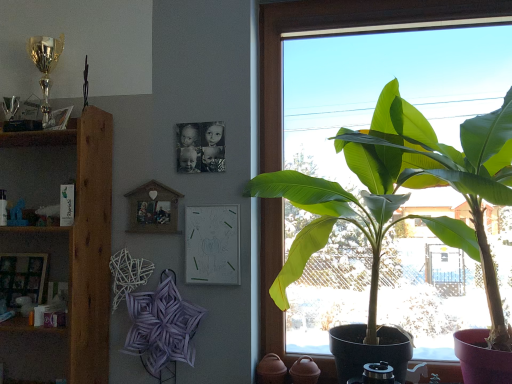
Question: Is white paper at center, the 1th picture frame viewed from the right, oriented away from wooden shelf at left?

Choices:
 (A) no
 (B) yes

Answer: (A)

Question: Considering the relative sizes of white paper at center, the 1th picture frame viewed from the right, and wooden shelf at left in the image provided, is white paper at center, the 1th picture frame viewed from the right, shorter than wooden shelf at left?

Choices:
 (A) yes
 (B) no

Answer: (A)

Question: Can you confirm if white paper at center, which is the 3th picture frame in left-to-right order, is smaller than wooden shelf at left?

Choices:
 (A) yes
 (B) no

Answer: (A)

Question: Is white paper at center, which is the 3th picture frame in left-to-right order, taller than wooden shelf at left?

Choices:
 (A) no
 (B) yes

Answer: (A)

Question: From the image's perspective, is white paper at center, which is the 3th picture frame in left-to-right order, under wooden shelf at left?

Choices:
 (A) yes
 (B) no

Answer: (B)

Question: Does white paper at center, which is the 3th picture frame in left-to-right order, have a greater width compared to wooden shelf at left?

Choices:
 (A) yes
 (B) no

Answer: (B)

Question: Considering the relative sizes of wooden shelf at left and wooden shelf at left in the image provided, is wooden shelf at left shorter than wooden shelf at left?

Choices:
 (A) no
 (B) yes

Answer: (B)

Question: Considering the relative sizes of wooden shelf at left and wooden shelf at left in the image provided, is wooden shelf at left thinner than wooden shelf at left?

Choices:
 (A) no
 (B) yes

Answer: (B)

Question: From the image's perspective, does wooden shelf at left appear higher than wooden shelf at left?

Choices:
 (A) yes
 (B) no

Answer: (A)

Question: Is wooden shelf at left smaller than wooden shelf at left?

Choices:
 (A) yes
 (B) no

Answer: (A)

Question: Is wooden shelf at left facing towards wooden shelf at left?

Choices:
 (A) no
 (B) yes

Answer: (B)

Question: Is wooden shelf at left inside wooden shelf at left?

Choices:
 (A) no
 (B) yes

Answer: (A)

Question: Can you confirm if green leafy plant at right is taller than wooden picture frame at lower left, the 3th picture frame from the right?

Choices:
 (A) yes
 (B) no

Answer: (A)